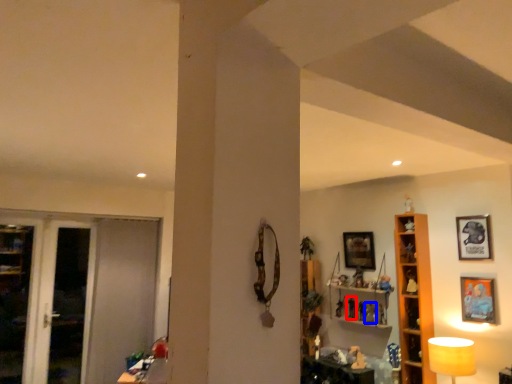
Question: Which object is closer to the camera taking this photo, toy (highlighted by a red box) or toy (highlighted by a blue box)?

Choices:
 (A) toy
 (B) toy

Answer: (B)